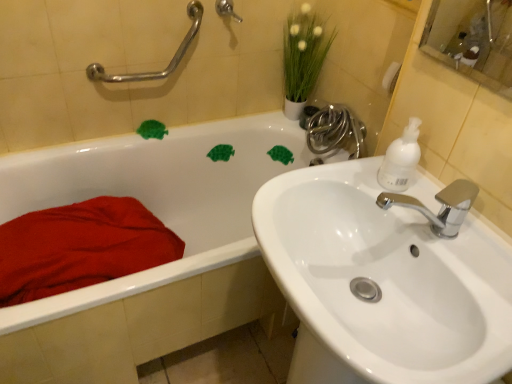
Question: From the image's perspective, is silver metallic grab bar at upper left, placed as the second shower when sorted from right to left, located beneath brushed metal shower handle at upper center, which is the first shower in right-to-left order?

Choices:
 (A) yes
 (B) no

Answer: (A)

Question: Can you confirm if silver metallic grab bar at upper left, which is the 1th shower in left-to-right order, is thinner than brushed metal shower handle at upper center, which is the first shower in right-to-left order?

Choices:
 (A) no
 (B) yes

Answer: (A)

Question: From a real-world perspective, is silver metallic grab bar at upper left, which is the 1th shower in left-to-right order, under brushed metal shower handle at upper center, the second shower when ordered from left to right?

Choices:
 (A) yes
 (B) no

Answer: (A)

Question: Is silver metallic grab bar at upper left, placed as the second shower when sorted from right to left, with brushed metal shower handle at upper center, the second shower when ordered from left to right?

Choices:
 (A) no
 (B) yes

Answer: (A)

Question: Is silver metallic grab bar at upper left, placed as the second shower when sorted from right to left, positioned before brushed metal shower handle at upper center, the second shower when ordered from left to right?

Choices:
 (A) no
 (B) yes

Answer: (B)

Question: From the image's perspective, is silver metallic grab bar at upper left, placed as the second shower when sorted from right to left, above brushed metal shower handle at upper center, which is the first shower in right-to-left order?

Choices:
 (A) yes
 (B) no

Answer: (B)

Question: Is shiny chrome faucet at upper right outside of brushed metal shower handle at upper center, which is the first shower in right-to-left order?

Choices:
 (A) yes
 (B) no

Answer: (A)

Question: Does shiny chrome faucet at upper right have a lesser width compared to brushed metal shower handle at upper center, the second shower when ordered from left to right?

Choices:
 (A) no
 (B) yes

Answer: (A)

Question: From a real-world perspective, is shiny chrome faucet at upper right positioned under brushed metal shower handle at upper center, which is the first shower in right-to-left order, based on gravity?

Choices:
 (A) no
 (B) yes

Answer: (B)

Question: Is shiny chrome faucet at upper right taller than brushed metal shower handle at upper center, which is the first shower in right-to-left order?

Choices:
 (A) yes
 (B) no

Answer: (A)

Question: From the image's perspective, does shiny chrome faucet at upper right appear lower than brushed metal shower handle at upper center, which is the first shower in right-to-left order?

Choices:
 (A) yes
 (B) no

Answer: (A)

Question: Is shiny chrome faucet at upper right at the right side of brushed metal shower handle at upper center, which is the first shower in right-to-left order?

Choices:
 (A) no
 (B) yes

Answer: (B)

Question: Does white matte soap dispenser at upper right appear on the left side of white glossy sink at right?

Choices:
 (A) no
 (B) yes

Answer: (A)